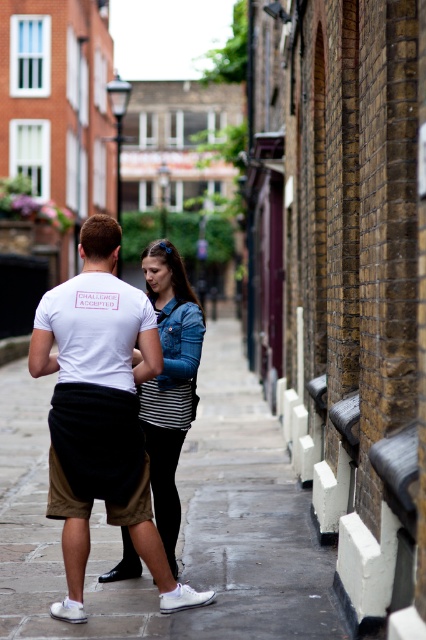
Which is below, white cotton t-shirt at center or denim jacket at center?

denim jacket at center is lower down.

Is white cotton t-shirt at center thinner than denim jacket at center?

No, white cotton t-shirt at center is not thinner than denim jacket at center.

This screenshot has width=426, height=640. What are the coordinates of `white cotton t-shirt at center` in the screenshot? It's located at (100, 413).

Looking at this image, how far apart are smooth concrete pavement at center and denim jacket at center?

smooth concrete pavement at center and denim jacket at center are 20.94 feet apart from each other.

Can you confirm if smooth concrete pavement at center is positioned to the right of denim jacket at center?

No, smooth concrete pavement at center is not to the right of denim jacket at center.

Where is `smooth concrete pavement at center`? The width and height of the screenshot is (426, 640). smooth concrete pavement at center is located at coordinates (181, 524).

In order to click on smooth concrete pavement at center in this screenshot , I will do `click(181, 524)`.

Who is positioned more to the left, smooth concrete pavement at center or white cotton t-shirt at center?

smooth concrete pavement at center

You are a GUI agent. You are given a task and a screenshot of the screen. Output one action in this format:
    pyautogui.click(x=<x>, y=<y>)
    Task: Click on the smooth concrete pavement at center
    
    Given the screenshot: What is the action you would take?
    (x=181, y=524)